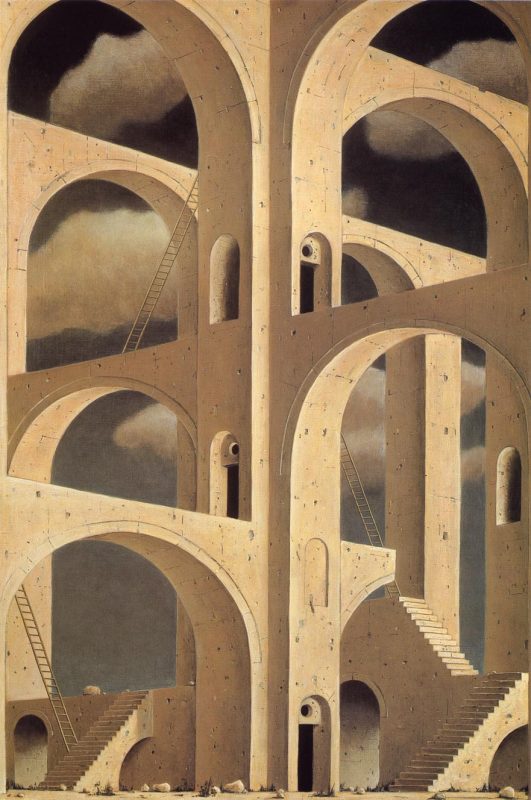
You are a GUI agent. You are given a task and a screenshot of the screen. Output one action in this format:
    pyautogui.click(x=<x>, y=<y>)
    Task: Click on the door
    The height and width of the screenshot is (800, 531).
    Given the screenshot: What is the action you would take?
    pyautogui.click(x=307, y=748)